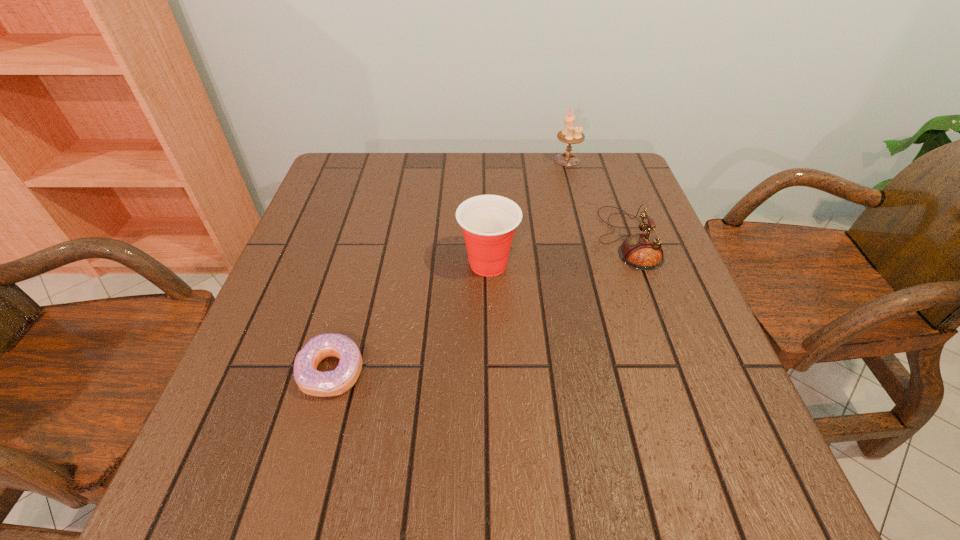
Locate an element on the screen. blank area located on the right of the nearest object is located at coordinates (546, 372).

I want to click on object positioned at the far edge, so click(x=570, y=135).

You are a GUI agent. You are given a task and a screenshot of the screen. Output one action in this format:
    pyautogui.click(x=<x>, y=<y>)
    Task: Click on the object located in the left edge section of the desktop
    Image resolution: width=960 pixels, height=540 pixels.
    Given the screenshot: What is the action you would take?
    (x=310, y=381)

Identify the location of candle holder situated at the right edge. The image size is (960, 540). (570, 135).

Where is `telephone that is at the right edge`? This screenshot has height=540, width=960. telephone that is at the right edge is located at coordinates (643, 251).

I want to click on object present at the far right corner, so click(x=570, y=135).

Where is `vacant area at the far edge of the desktop`? This screenshot has height=540, width=960. vacant area at the far edge of the desktop is located at coordinates (458, 191).

Where is `free spot at the near edge of the desktop`? The image size is (960, 540). free spot at the near edge of the desktop is located at coordinates (509, 471).

The image size is (960, 540). Identify the location of vacant space at the left edge of the desktop. (339, 212).

The width and height of the screenshot is (960, 540). I want to click on vacant space at the right edge, so click(x=673, y=298).